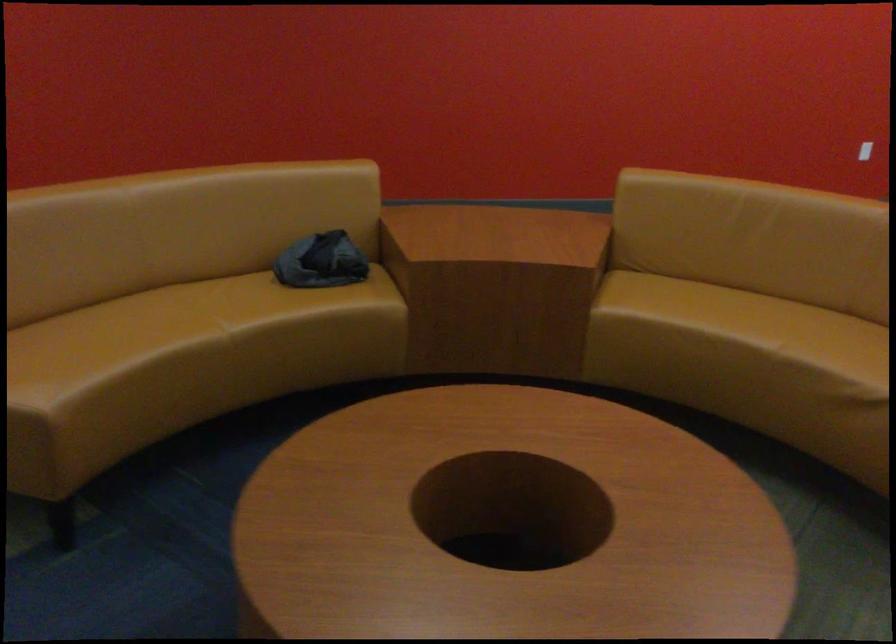
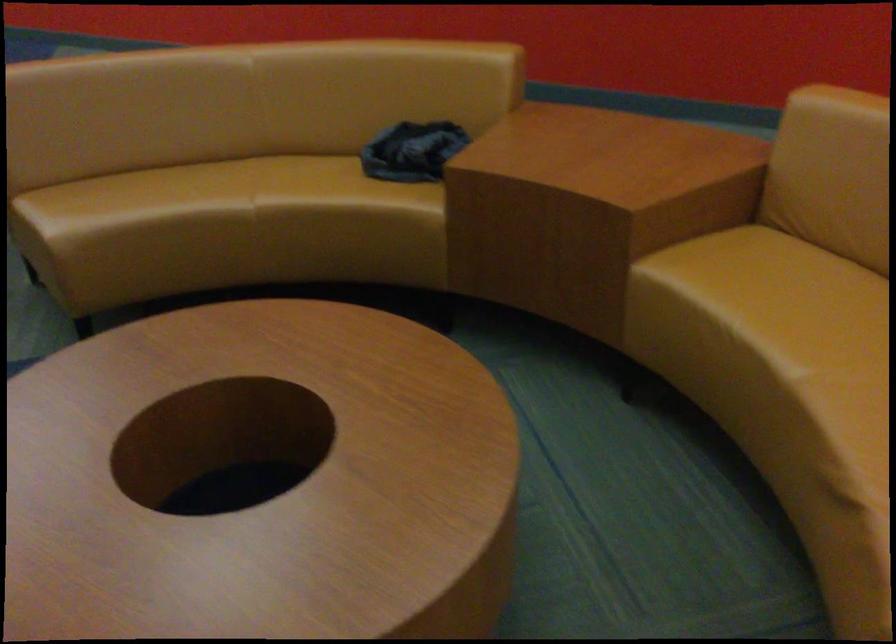
Locate, in the second image, the point that corresponds to point (236, 346) in the first image.

(255, 220)